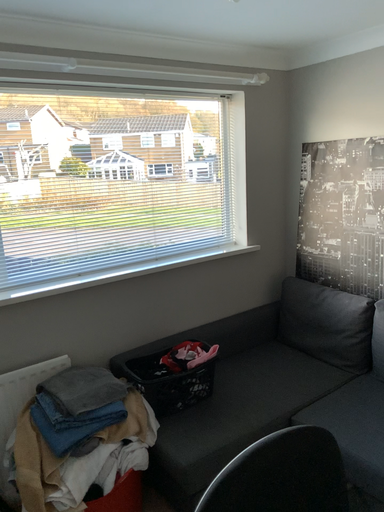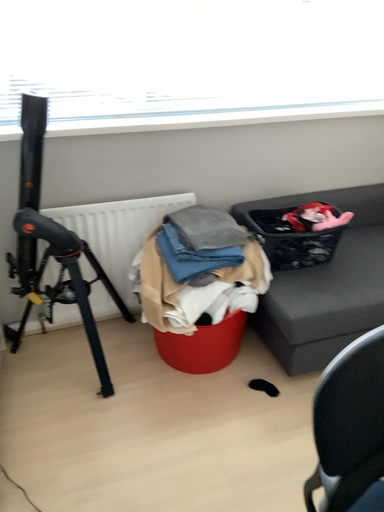
Question: Which way did the camera rotate in the video?

Choices:
 (A) rotated left
 (B) rotated right

Answer: (A)